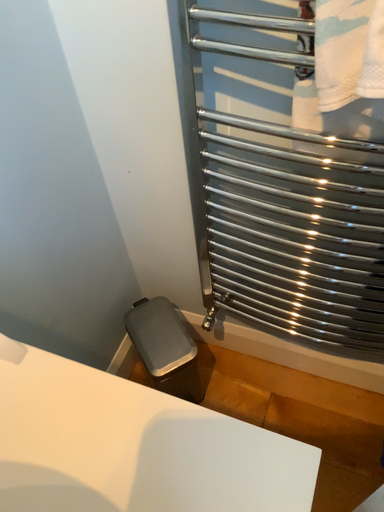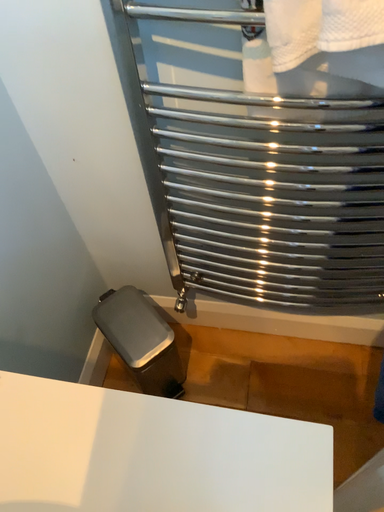
Question: How did the camera likely rotate when shooting the video?

Choices:
 (A) rotated left
 (B) rotated right

Answer: (B)